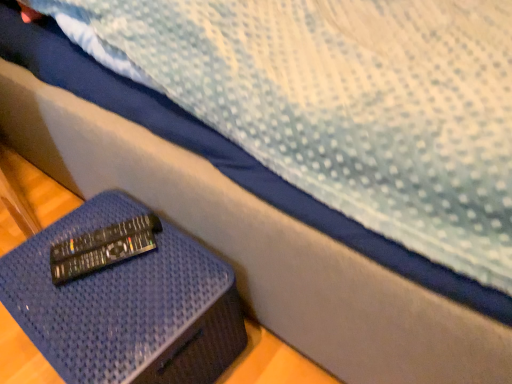
Locate an element on the screen. free point behind black plastic remote at lower left, acting as the 1th remote starting from the back is located at coordinates (112, 211).